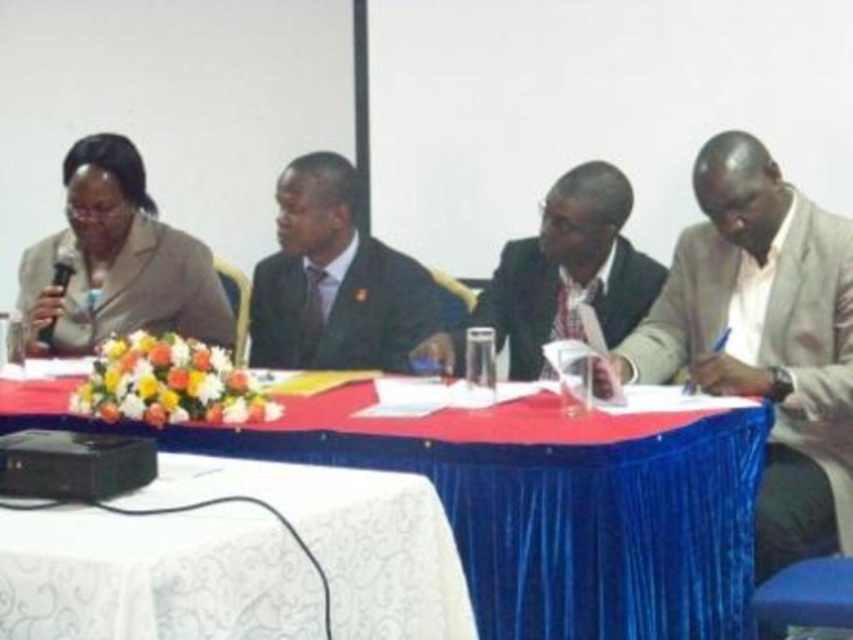
Question: Is blue fabric table at center above satin black suit at center?

Choices:
 (A) no
 (B) yes

Answer: (A)

Question: Among these points, which one is nearest to the camera?

Choices:
 (A) (732, 548)
 (B) (115, 241)
 (C) (273, 260)
 (D) (770, 497)

Answer: (A)

Question: Can you confirm if blue fabric table at center is wider than matte black suit at center?

Choices:
 (A) yes
 (B) no

Answer: (A)

Question: Can you confirm if white lace tablecloth at lower left is positioned to the left of matte black suit at center?

Choices:
 (A) yes
 (B) no

Answer: (A)

Question: Which object appears farthest from the camera in this image?

Choices:
 (A) light beige suit at right
 (B) blue fabric table at center
 (C) matte beige suit at left

Answer: (C)

Question: Which point is closer to the camera?

Choices:
 (A) blue fabric table at center
 (B) white lace tablecloth at lower left

Answer: (B)